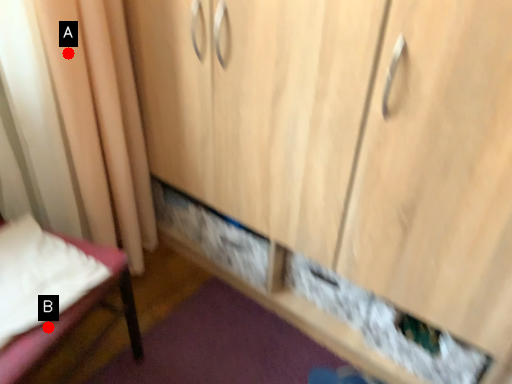
Question: Two points are circled on the image, labeled by A and B beside each circle. Which of the following is the farthest from the observer?

Choices:
 (A) A is further
 (B) B is further

Answer: (A)